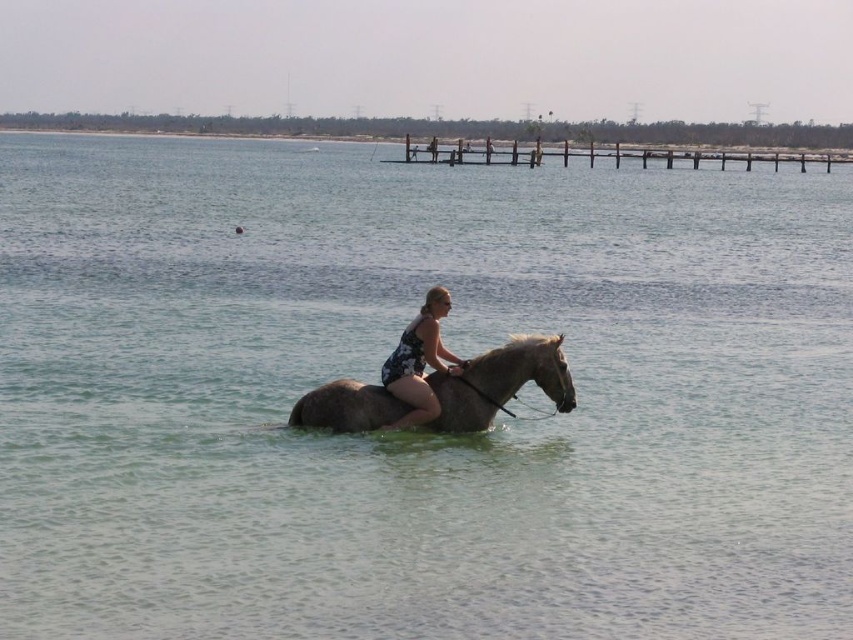
Does gray matte horse at center have a greater width compared to floral fabric woman at center?

Correct, the width of gray matte horse at center exceeds that of floral fabric woman at center.

Which is below, gray matte horse at center or floral fabric woman at center?

gray matte horse at center

Which is in front, point (407, 408) or point (410, 356)?

Point (410, 356) is more forward.

Where is `gray matte horse at center`? Image resolution: width=853 pixels, height=640 pixels. gray matte horse at center is located at coordinates (500, 381).

Between gray matte horse at center and wooden at upper center, which one appears on the right side from the viewer's perspective?

Positioned to the right is wooden at upper center.

Is point (558, 408) in front of point (799, 156)?

Yes.

Is point (485, 419) farther from viewer compared to point (746, 150)?

No, (485, 419) is closer to viewer.

Find the location of a particular element. This screenshot has width=853, height=640. gray matte horse at center is located at coordinates (500, 381).

Is wooden at upper center below floral fabric woman at center?

Incorrect, wooden at upper center is not positioned below floral fabric woman at center.

Locate an element on the screen. wooden at upper center is located at coordinates (601, 154).